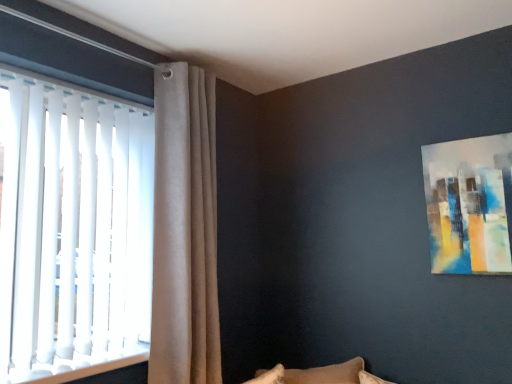
Question: Considering their positions, is beige velvet curtain at upper left located in front of or behind abstract painting at upper right?

Choices:
 (A) behind
 (B) front

Answer: (A)

Question: From a real-world perspective, is beige velvet curtain at upper left above or below abstract painting at upper right?

Choices:
 (A) above
 (B) below

Answer: (B)

Question: Estimate the real-world distances between objects in this image. Which object is farther from the abstract painting at upper right?

Choices:
 (A) beige velvet curtain at upper left
 (B) white vertical blinds at left

Answer: (B)

Question: Considering the real-world distances, which object is closest to the beige velvet curtain at upper left?

Choices:
 (A) abstract painting at upper right
 (B) white vertical blinds at left

Answer: (B)